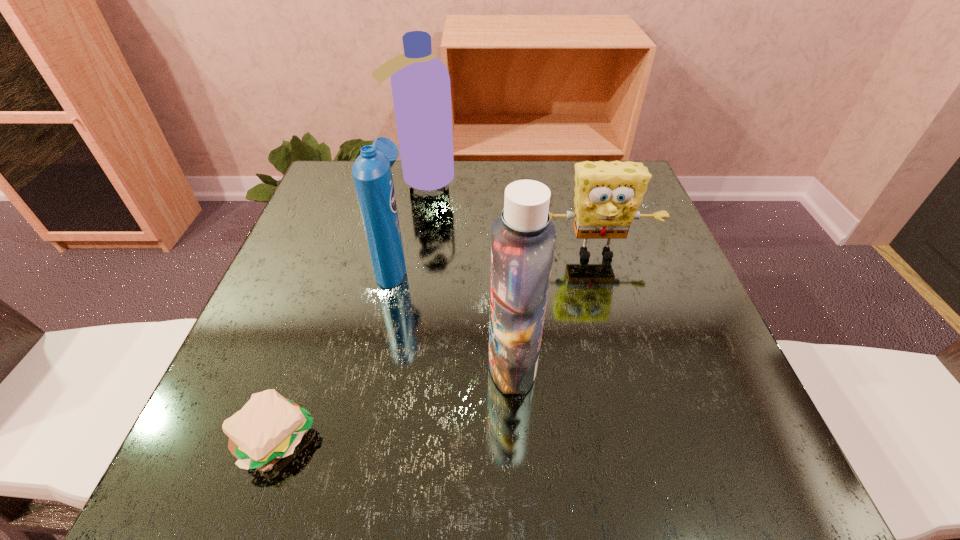
At what (x,y) coordinates should I click in order to perform the action: click on object positioned at the near left corner. Please return your answer as a coordinate pair (x, y). The width and height of the screenshot is (960, 540). Looking at the image, I should click on (268, 428).

Find the location of a particular element. This screenshot has height=540, width=960. vacant space at the far edge of the desktop is located at coordinates (461, 206).

Image resolution: width=960 pixels, height=540 pixels. In order to click on free region at the near edge of the desktop in this screenshot , I will do `click(509, 452)`.

In the image, there is a desktop. Where is `vacant space at the left edge`? Image resolution: width=960 pixels, height=540 pixels. vacant space at the left edge is located at coordinates (331, 304).

Locate an element on the screen. The height and width of the screenshot is (540, 960). blank space at the right edge is located at coordinates (658, 265).

Locate an element on the screen. The width and height of the screenshot is (960, 540). free spot between the rightmost shampoo and the shortest shampoo is located at coordinates (453, 313).

This screenshot has width=960, height=540. What are the coordinates of `vacant region between the second nearest object and the farthest object` in the screenshot? It's located at (468, 271).

Find the location of `unoccupied area between the farthest object and the rightmost shampoo`. unoccupied area between the farthest object and the rightmost shampoo is located at coordinates (468, 271).

Find the location of a particular element. The image size is (960, 540). unoccupied area between the nearest object and the farthest shampoo is located at coordinates (349, 309).

Image resolution: width=960 pixels, height=540 pixels. In order to click on empty location between the nearest object and the rightmost object in this screenshot , I will do `click(436, 346)`.